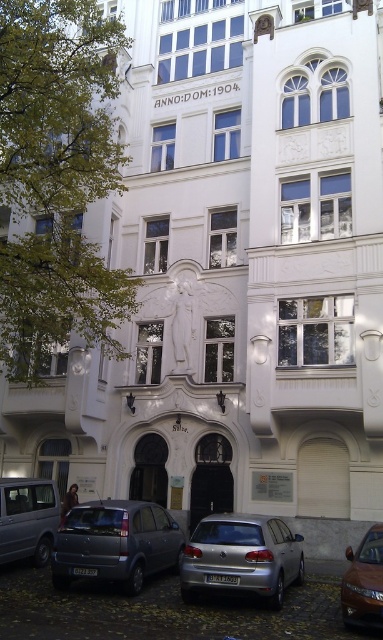
Question: Considering the relative positions of matte gray car at lower left and white stone statue at center in the image provided, where is matte gray car at lower left located with respect to white stone statue at center?

Choices:
 (A) above
 (B) below

Answer: (B)

Question: Can you confirm if silver metallic van at lower left is positioned below brown metallic car at lower right?

Choices:
 (A) yes
 (B) no

Answer: (B)

Question: Observing the image, what is the correct spatial positioning of silver metallic car at center in reference to silver metallic van at lower left?

Choices:
 (A) left
 (B) right

Answer: (B)

Question: Which of these objects is positioned farthest from the matte gray car at lower left?

Choices:
 (A) silver metallic van at lower left
 (B) brown metallic car at lower right
 (C) silver metallic car at center

Answer: (B)

Question: Which point is closer to the camera?

Choices:
 (A) matte gray car at lower left
 (B) white stone statue at center
 (C) silver metallic car at center
 (D) silver metallic van at lower left

Answer: (C)

Question: Which object appears farthest from the camera in this image?

Choices:
 (A) silver metallic van at lower left
 (B) white stone statue at center

Answer: (B)